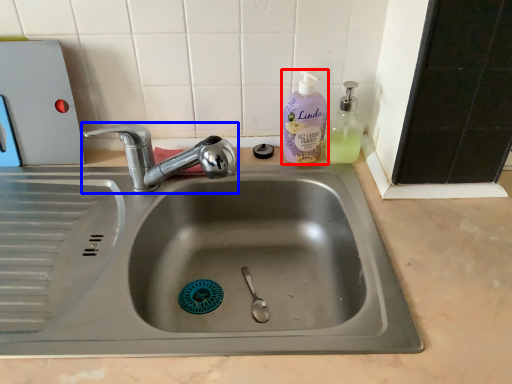
Question: Which point is further to the camera, cleaning product (highlighted by a red box) or tap (highlighted by a blue box)?

Choices:
 (A) cleaning product
 (B) tap

Answer: (A)